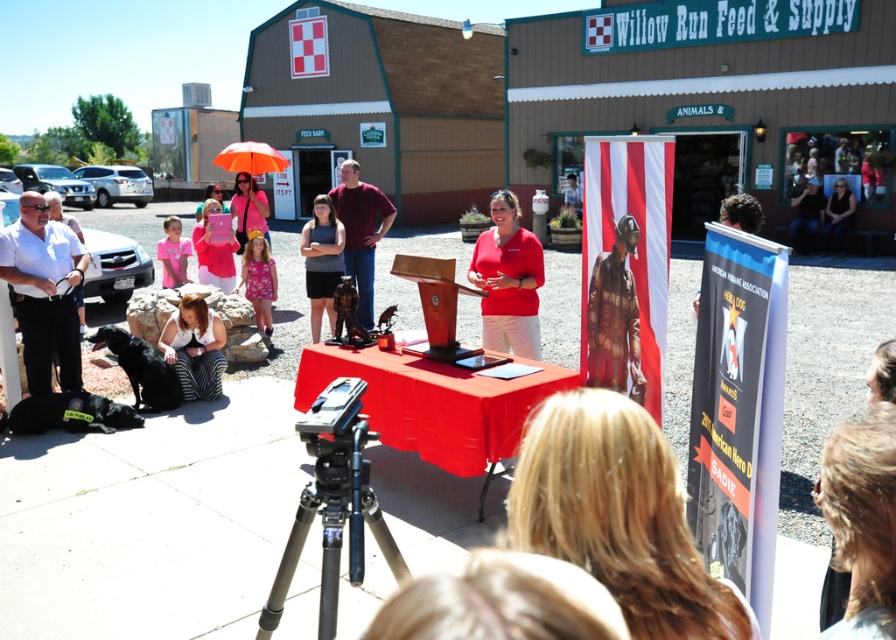
Question: Among these objects, which one is nearest to the camera?

Choices:
 (A) orange matte umbrella at upper center
 (B) white shirt at left

Answer: (B)

Question: Does white shirt at left have a smaller size compared to orange matte umbrella at upper center?

Choices:
 (A) yes
 (B) no

Answer: (A)

Question: Which point appears closest to the camera in this image?

Choices:
 (A) [x=315, y=276]
 (B) [x=372, y=228]
 (C) [x=218, y=396]
 (D) [x=238, y=141]

Answer: (C)

Question: Is white shirt at left below maroon fabric shirt at center?

Choices:
 (A) yes
 (B) no

Answer: (A)

Question: Which object appears farthest from the camera in this image?

Choices:
 (A) white shirt at left
 (B) matte red shirt at center
 (C) orange matte umbrella at upper center
 (D) gray fabric shirt at center

Answer: (C)

Question: Is gray fabric shirt at center wider than orange matte umbrella at upper center?

Choices:
 (A) yes
 (B) no

Answer: (B)